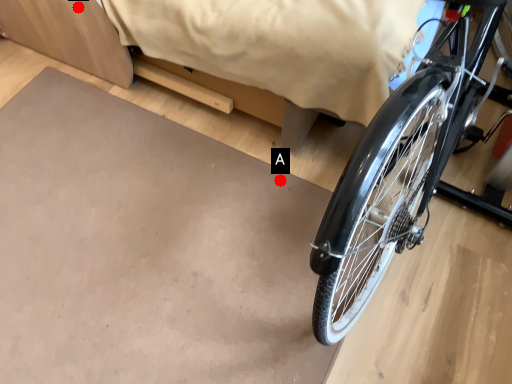
Question: Two points are circled on the image, labeled by A and B beside each circle. Which point is farther from the camera taking this photo?

Choices:
 (A) A is further
 (B) B is further

Answer: (A)